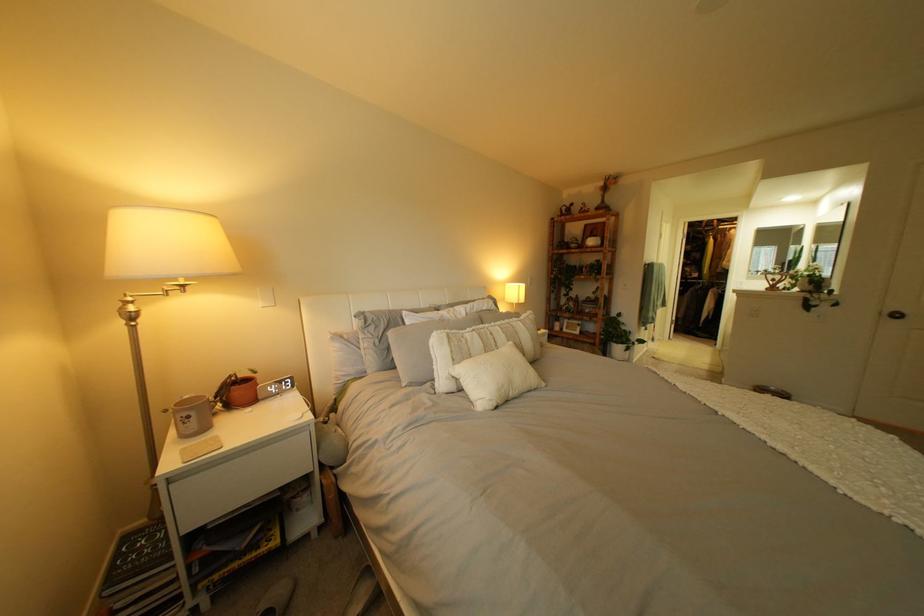
Describe the element at coordinates (894, 314) in the screenshot. I see `the silver door knob` at that location.